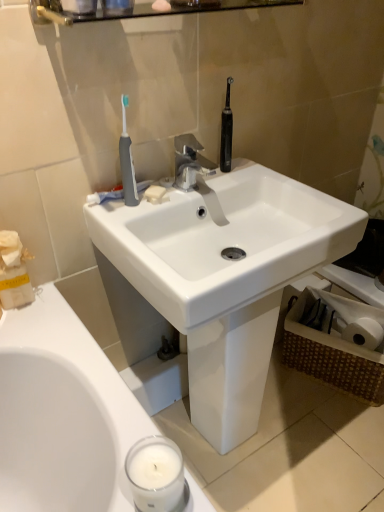
Where is `unoccupied area behind silver metallic faucet at center`? The height and width of the screenshot is (512, 384). unoccupied area behind silver metallic faucet at center is located at coordinates (215, 173).